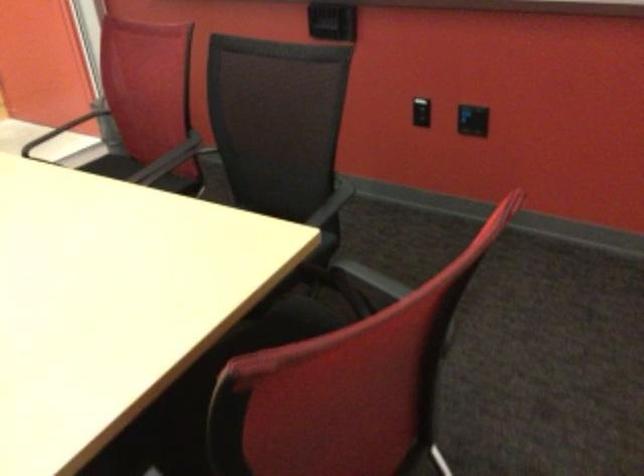
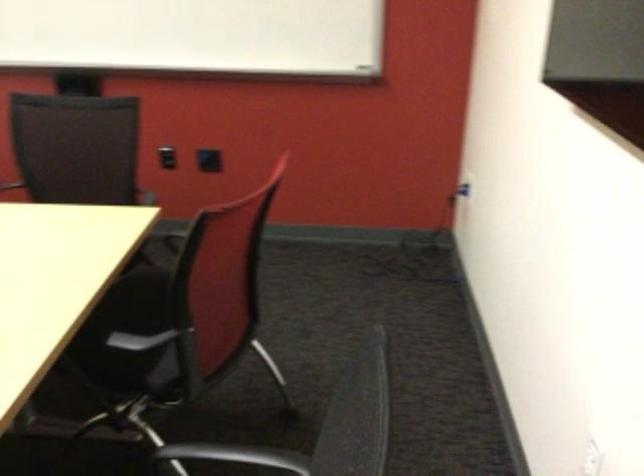
Locate, in the second image, the point that corresponds to [464,118] in the first image.

(207, 160)